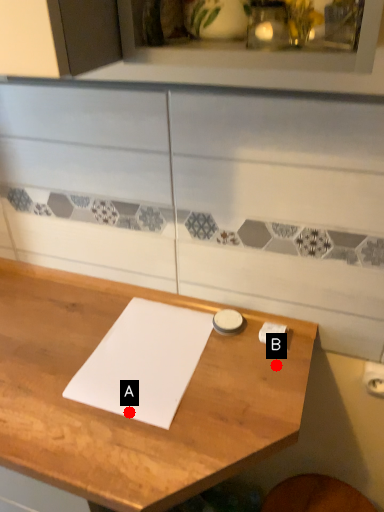
Question: Two points are circled on the image, labeled by A and B beside each circle. Among these points, which one is nearest to the camera?

Choices:
 (A) A is closer
 (B) B is closer

Answer: (A)